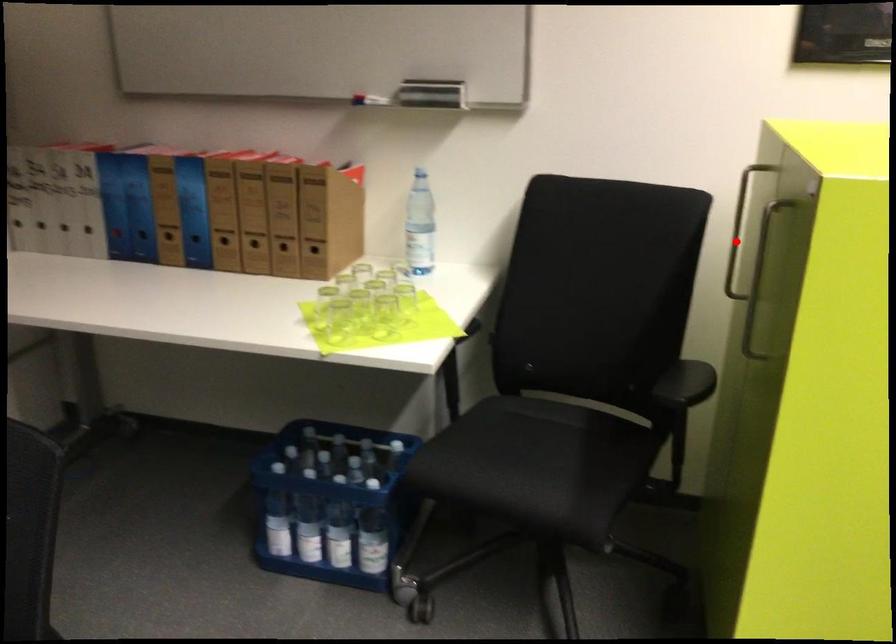
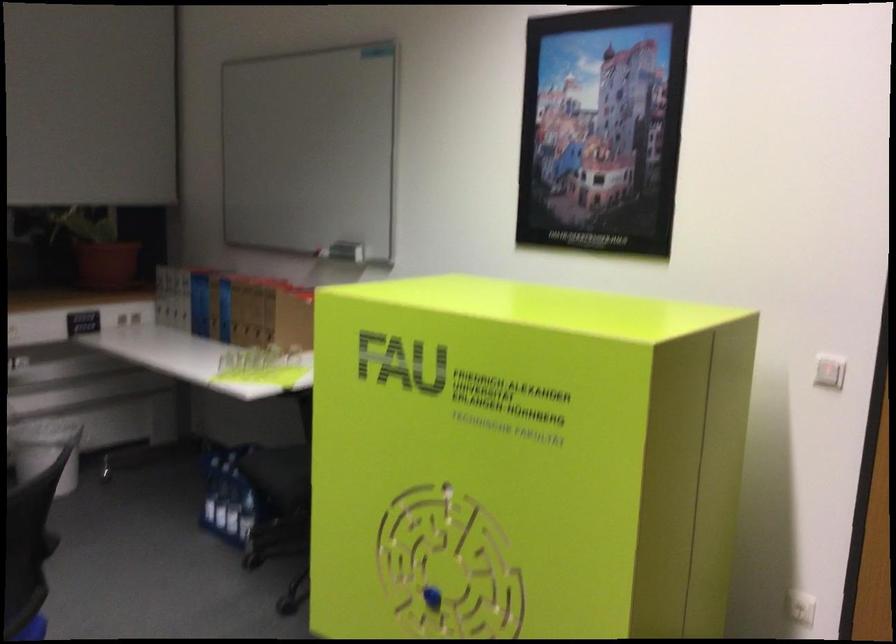
Question: I am providing you with two images of the same scene from different viewpoints. A red point is marked on the first image. Can you still see the location of the red point in image 2?

Choices:
 (A) Yes
 (B) No

Answer: (B)